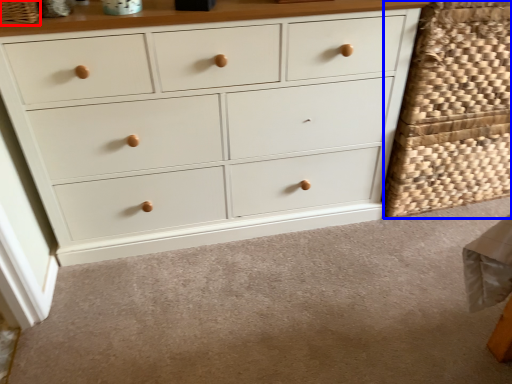
Question: Which of the following is the closest to the observer, basket (highlighted by a red box) or basket (highlighted by a blue box)?

Choices:
 (A) basket
 (B) basket

Answer: (A)